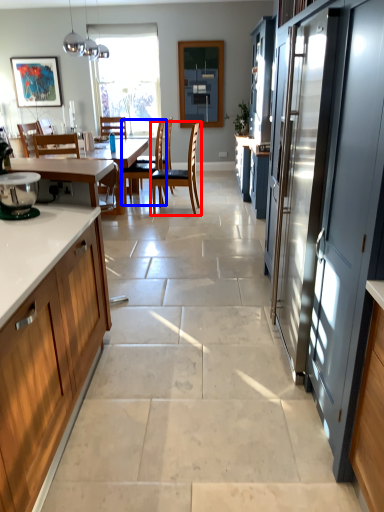
Question: Which object appears farthest to the camera in this image, chair (highlighted by a red box) or chair (highlighted by a blue box)?

Choices:
 (A) chair
 (B) chair

Answer: (B)